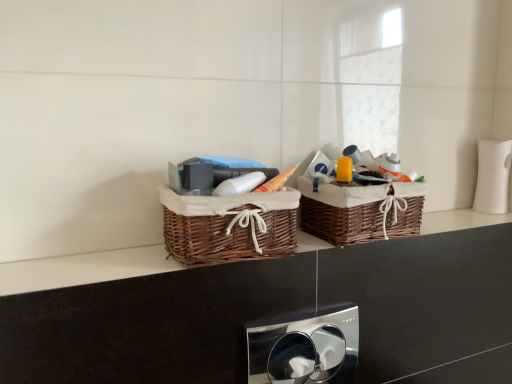
Question: Considering the positions of woven brown basket at center, which is the first picnic basket in left-to-right order, and woven brown basket at center, which is the 2th picnic basket in left-to-right order, in the image, is woven brown basket at center, which is the first picnic basket in left-to-right order, wider or thinner than woven brown basket at center, which is the 2th picnic basket in left-to-right order,?

Choices:
 (A) thin
 (B) wide

Answer: (A)

Question: Is woven brown basket at center, which is the first picnic basket in left-to-right order, inside or outside of woven brown basket at center, which is the 2th picnic basket in left-to-right order?

Choices:
 (A) inside
 (B) outside

Answer: (B)

Question: Which of these objects is positioned closest to the woven brown basket at center, which is the first picnic basket in left-to-right order?

Choices:
 (A) brown wicker baskets at center
 (B) chrome metallic flush plate at center
 (C) woven brown basket at center, which is the 2th picnic basket in left-to-right order

Answer: (C)

Question: Which of these objects is positioned farthest from the brown wicker baskets at center?

Choices:
 (A) woven brown basket at center, which appears as the 2th picnic basket when viewed from the right
 (B) woven brown basket at center, which is the 2th picnic basket in left-to-right order
 (C) chrome metallic flush plate at center

Answer: (C)